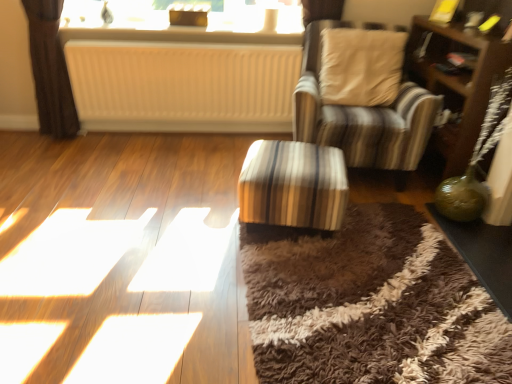
Find the location of a particular element. This screenshot has width=512, height=384. vacant space to the right of striped fabric ottoman at center, positioned as the 2th table in right-to-left order is located at coordinates (386, 234).